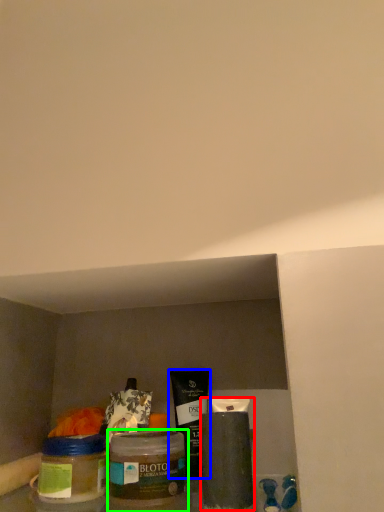
Question: Considering the real-world distances, which object is closest to cleaning product (highlighted by a red box)? product (highlighted by a blue box) or glass jar (highlighted by a green box).

Choices:
 (A) product
 (B) glass jar

Answer: (A)